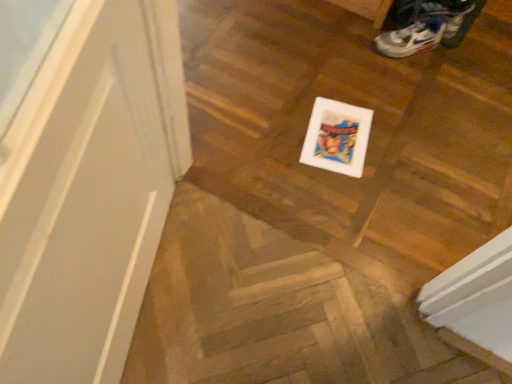
Where is `free space above wooden floor at center (from a real-world perspective)`? free space above wooden floor at center (from a real-world perspective) is located at coordinates tap(282, 322).